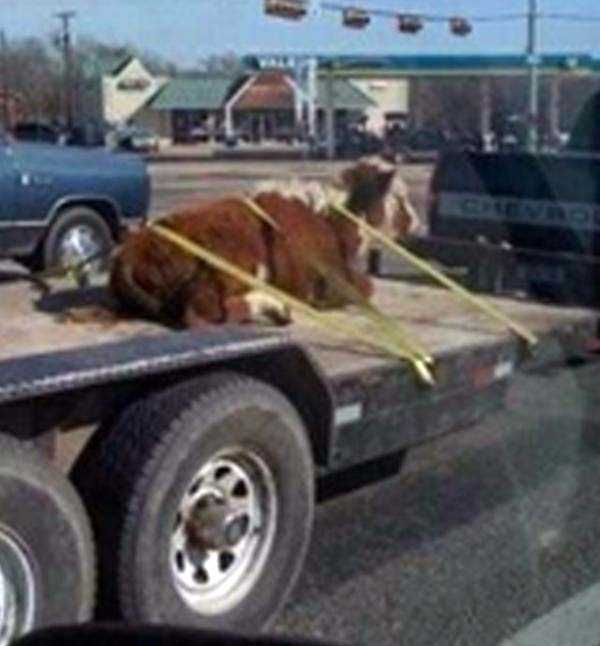
Find the location of `cables`. cables is located at coordinates (499, 15), (581, 19).